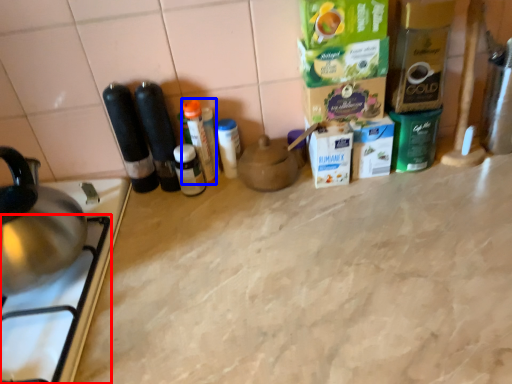
Question: Among these objects, which one is nearest to the camera, gas stove (highlighted by a red box) or bottle (highlighted by a blue box)?

Choices:
 (A) gas stove
 (B) bottle

Answer: (A)